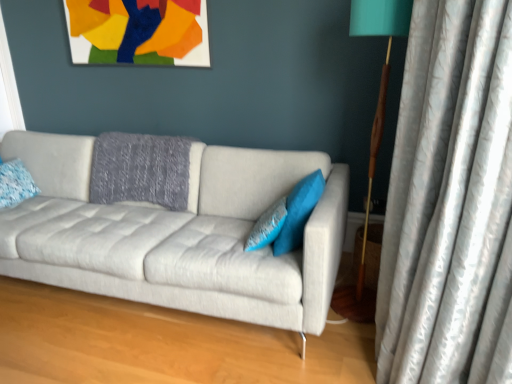
Question: Is blue textured pillow at left, the first pillow in the left-to-right sequence, positioned in front of matte paper picture frame at upper center?

Choices:
 (A) yes
 (B) no

Answer: (A)

Question: Is blue textured pillow at left, the first pillow in the left-to-right sequence, located outside matte paper picture frame at upper center?

Choices:
 (A) yes
 (B) no

Answer: (A)

Question: Could you tell me if blue textured pillow at left, the first pillow in the left-to-right sequence, is turned towards matte paper picture frame at upper center?

Choices:
 (A) yes
 (B) no

Answer: (B)

Question: Is blue textured pillow at left, which is the 3th pillow from right to left, oriented away from matte paper picture frame at upper center?

Choices:
 (A) no
 (B) yes

Answer: (A)

Question: From the image's perspective, is blue textured pillow at left, the first pillow in the left-to-right sequence, above matte paper picture frame at upper center?

Choices:
 (A) no
 (B) yes

Answer: (A)

Question: Is teal fabric lampshade at right in front of or behind light gray fabric couch at center in the image?

Choices:
 (A) behind
 (B) front

Answer: (A)

Question: Looking at their shapes, would you say teal fabric lampshade at right is wider or thinner than light gray fabric couch at center?

Choices:
 (A) thin
 (B) wide

Answer: (A)

Question: Based on their positions, is teal fabric lampshade at right located to the left or right of light gray fabric couch at center?

Choices:
 (A) left
 (B) right

Answer: (B)

Question: Looking at the image, does teal fabric lampshade at right seem bigger or smaller compared to light gray fabric couch at center?

Choices:
 (A) big
 (B) small

Answer: (B)

Question: Is silvery textured curtain at right wider or thinner than teal fabric pillow at center, which is the 1th pillow from right to left?

Choices:
 (A) wide
 (B) thin

Answer: (A)

Question: Considering the positions of silvery textured curtain at right and teal fabric pillow at center, which is the 1th pillow from right to left, in the image, is silvery textured curtain at right taller or shorter than teal fabric pillow at center, which is the 1th pillow from right to left,?

Choices:
 (A) tall
 (B) short

Answer: (A)

Question: Based on their sizes in the image, would you say silvery textured curtain at right is bigger or smaller than teal fabric pillow at center, the third pillow from the left?

Choices:
 (A) big
 (B) small

Answer: (A)

Question: Is point (453, 46) closer or farther from the camera than point (315, 177)?

Choices:
 (A) farther
 (B) closer

Answer: (B)

Question: Looking at the image, does teal fabric pillow at center, which is the 1th pillow from right to left, seem bigger or smaller compared to blue textured pillow at left, the first pillow in the left-to-right sequence?

Choices:
 (A) big
 (B) small

Answer: (A)

Question: From the image's perspective, is teal fabric pillow at center, which is the 1th pillow from right to left, located above or below blue textured pillow at left, the first pillow in the left-to-right sequence?

Choices:
 (A) above
 (B) below

Answer: (B)